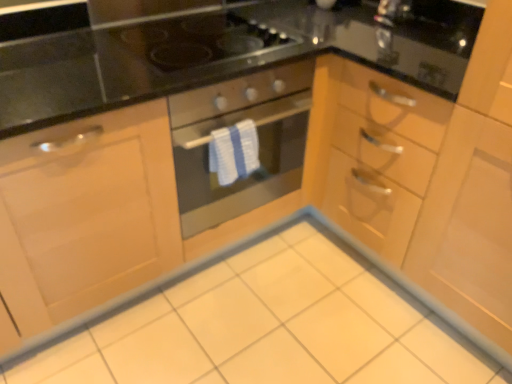
Question: Is black glass gas stove at upper center situated inside matte black oven at center or outside?

Choices:
 (A) inside
 (B) outside

Answer: (B)

Question: From a real-world perspective, is black glass gas stove at upper center physically located above or below matte black oven at center?

Choices:
 (A) below
 (B) above

Answer: (B)

Question: Which of these objects is positioned farthest from the black glass gas stove at upper center?

Choices:
 (A) white glossy ceramic tile at center
 (B) matte black oven at center

Answer: (A)

Question: Which object is positioned farthest from the matte black oven at center?

Choices:
 (A) white glossy ceramic tile at center
 (B) black glass gas stove at upper center

Answer: (A)